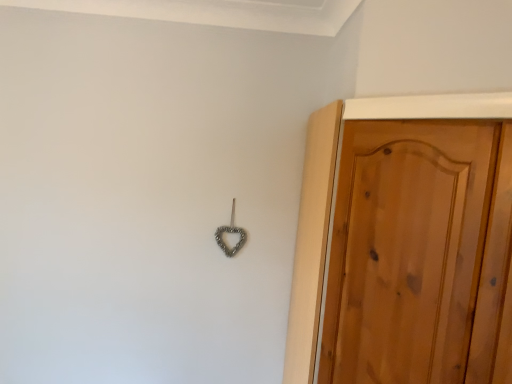
Question: Does metallic heart-shaped hook at center have a greater height compared to wooden door at right?

Choices:
 (A) no
 (B) yes

Answer: (A)

Question: Is metallic heart-shaped hook at center facing away from wooden door at right?

Choices:
 (A) no
 (B) yes

Answer: (A)

Question: From the image's perspective, is metallic heart-shaped hook at center beneath wooden door at right?

Choices:
 (A) no
 (B) yes

Answer: (A)

Question: Is there a large distance between metallic heart-shaped hook at center and wooden door at right?

Choices:
 (A) no
 (B) yes

Answer: (A)

Question: Considering the relative positions of metallic heart-shaped hook at center and wooden door at right in the image provided, is metallic heart-shaped hook at center to the left of wooden door at right from the viewer's perspective?

Choices:
 (A) yes
 (B) no

Answer: (A)

Question: Is metallic heart-shaped hook at center to the right of wooden door at right from the viewer's perspective?

Choices:
 (A) no
 (B) yes

Answer: (A)

Question: Does wooden door at right have a smaller size compared to metallic heart-shaped hook at center?

Choices:
 (A) yes
 (B) no

Answer: (B)

Question: Is wooden door at right taller than metallic heart-shaped hook at center?

Choices:
 (A) no
 (B) yes

Answer: (B)

Question: Does wooden door at right have a lesser width compared to metallic heart-shaped hook at center?

Choices:
 (A) no
 (B) yes

Answer: (A)

Question: Considering the relative positions of wooden door at right and metallic heart-shaped hook at center in the image provided, is wooden door at right to the left of metallic heart-shaped hook at center from the viewer's perspective?

Choices:
 (A) yes
 (B) no

Answer: (B)

Question: From a real-world perspective, is wooden door at right positioned under metallic heart-shaped hook at center based on gravity?

Choices:
 (A) no
 (B) yes

Answer: (B)

Question: From a real-world perspective, is wooden door at right located higher than metallic heart-shaped hook at center?

Choices:
 (A) yes
 (B) no

Answer: (B)

Question: Based on their positions, is metallic heart-shaped hook at center located to the left or right of wooden door at right?

Choices:
 (A) right
 (B) left

Answer: (B)